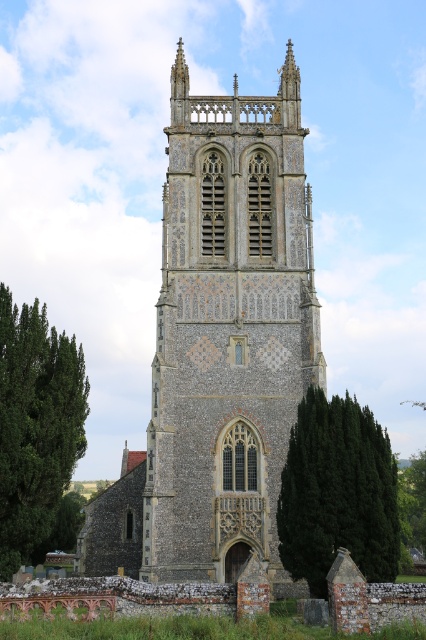
Question: Estimate the real-world distances between objects in this image. Which object is farther from the green leafy tree at left?

Choices:
 (A) dark green coniferous tree at lower right
 (B) stone tower at center

Answer: (A)

Question: Is stone tower at center bigger than green leafy tree at left?

Choices:
 (A) no
 (B) yes

Answer: (B)

Question: Based on their relative distances, which object is farther from the dark green coniferous tree at lower right?

Choices:
 (A) green leafy tree at left
 (B) stone tower at center

Answer: (A)

Question: Does stone tower at center appear under dark green coniferous tree at lower right?

Choices:
 (A) no
 (B) yes

Answer: (A)

Question: Where is stone tower at center located in relation to green leafy tree at left in the image?

Choices:
 (A) above
 (B) below

Answer: (A)

Question: Which point is closer to the camera taking this photo?

Choices:
 (A) (342, 419)
 (B) (278, 92)
 (C) (74, 428)

Answer: (A)